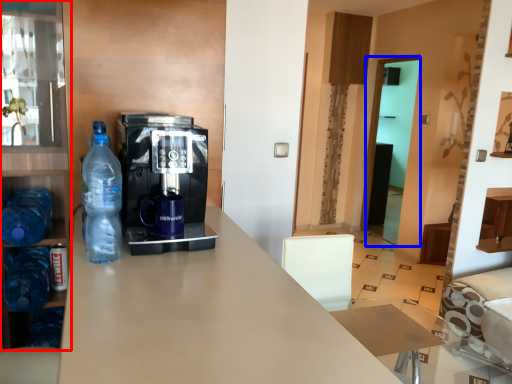
Question: Among these objects, which one is farthest to the camera, cabinetry (highlighted by a red box) or glass door (highlighted by a blue box)?

Choices:
 (A) cabinetry
 (B) glass door

Answer: (B)